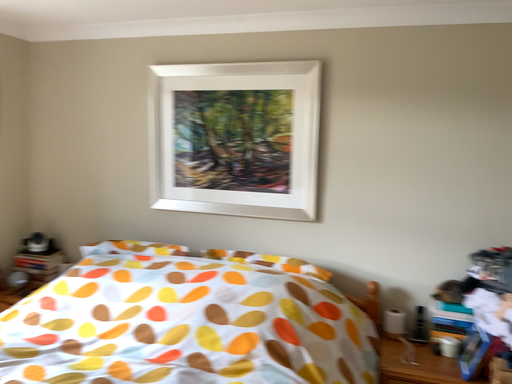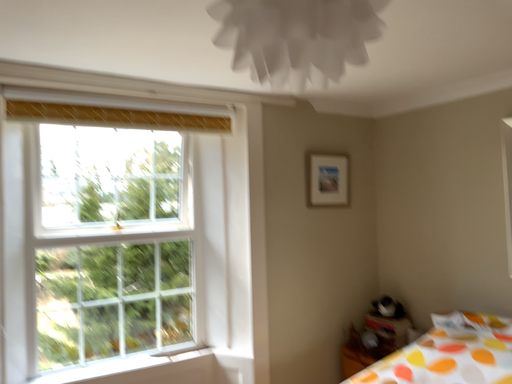
Question: Which way did the camera rotate in the video?

Choices:
 (A) rotated downward
 (B) rotated upward

Answer: (B)